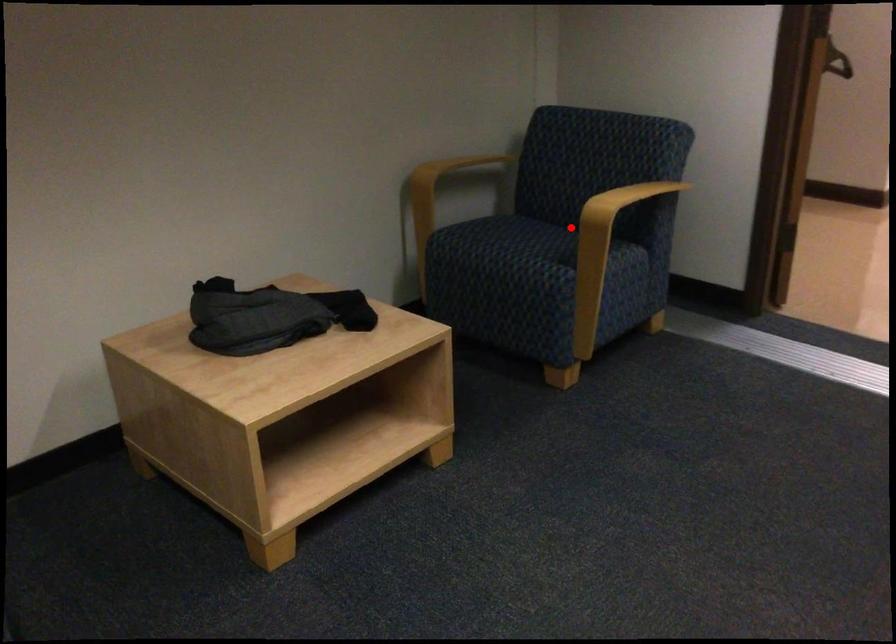
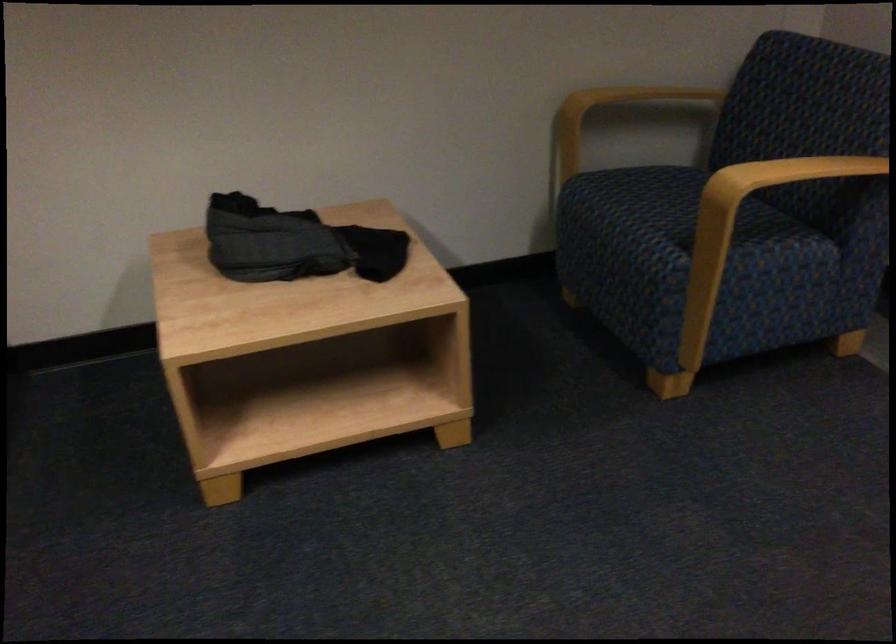
Locate, in the second image, the point that corresponds to the highlighted location in the first image.

(757, 196)